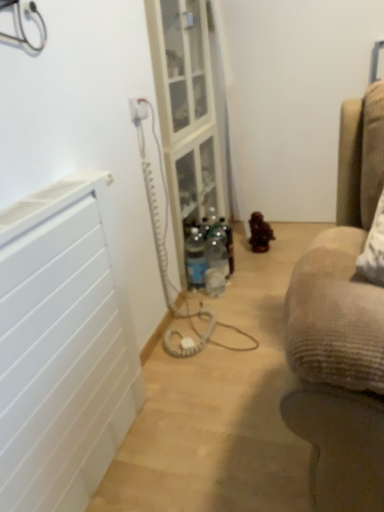
Locate an element on the screen. spots to the right of white matte radiator at left is located at coordinates (205, 433).